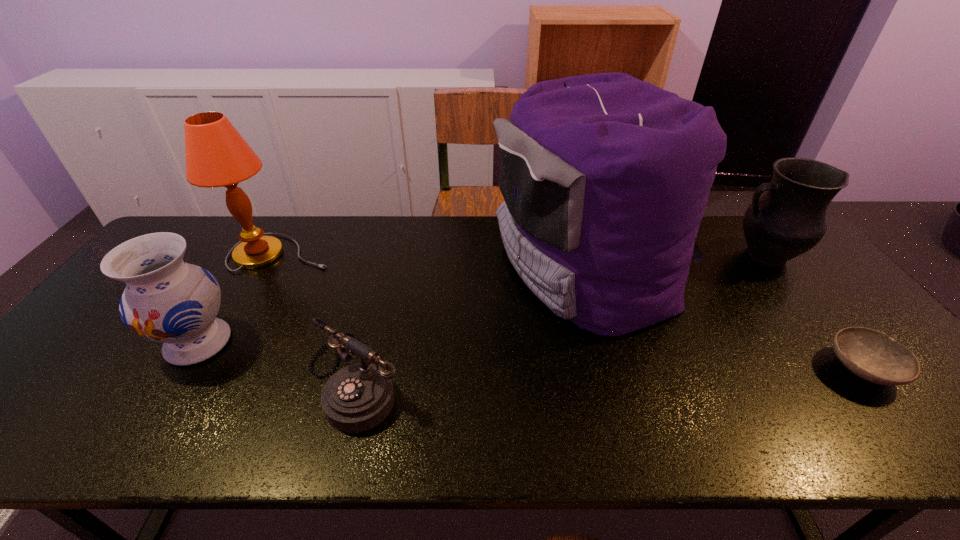
Where is `free point that satisfies the following two spatial constraints: 1. on the front pocket of the bowl; 2. on the left side of the backpack`? The height and width of the screenshot is (540, 960). free point that satisfies the following two spatial constraints: 1. on the front pocket of the bowl; 2. on the left side of the backpack is located at coordinates (616, 369).

You are a GUI agent. You are given a task and a screenshot of the screen. Output one action in this format:
    pyautogui.click(x=<x>, y=<y>)
    Task: Click on the free space that satisfies the following two spatial constraints: 1. on the handle side of the bowl; 2. on the left side of the pitcher
    The width and height of the screenshot is (960, 540).
    Given the screenshot: What is the action you would take?
    pyautogui.click(x=852, y=369)

You are a GUI agent. You are given a task and a screenshot of the screen. Output one action in this format:
    pyautogui.click(x=<x>, y=<y>)
    Task: Click on the vacant space that satisfies the following two spatial constraints: 1. on the back side of the shortest object; 2. on the front pocket of the tallest object
    
    Given the screenshot: What is the action you would take?
    pyautogui.click(x=781, y=268)